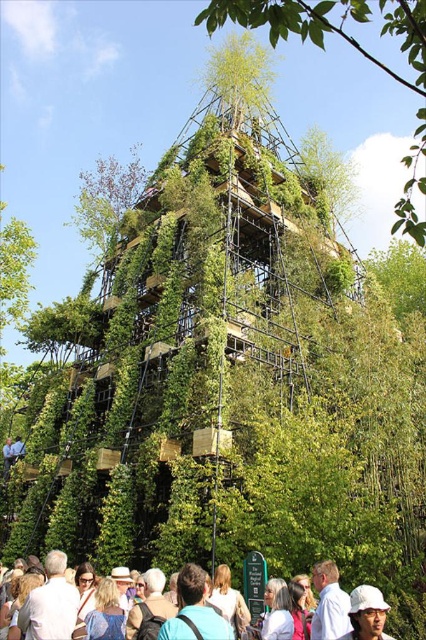
Which is in front, point (198, 632) or point (321, 584)?

Positioned in front is point (198, 632).

Can you confirm if light brown hair at center is taller than white cotton shirt at lower center?

Indeed, light brown hair at center has a greater height compared to white cotton shirt at lower center.

Between point (192, 616) and point (334, 564), which one is positioned in front?

Point (192, 616) is in front.

Locate an element on the screen. This screenshot has height=640, width=426. light brown hair at center is located at coordinates (195, 611).

Who is lower down, green leafy structure at center or white shirt at lower left?

Positioned lower is white shirt at lower left.

I want to click on green leafy structure at center, so click(356, 49).

Who is positioned more to the left, white cotton shirt at lower center or white matte hat at center?

white cotton shirt at lower center is more to the left.

Does white cotton shirt at lower center have a greater height compared to white matte hat at center?

Indeed, white cotton shirt at lower center has a greater height compared to white matte hat at center.

Locate an element on the screen. The width and height of the screenshot is (426, 640). white cotton shirt at lower center is located at coordinates (328, 604).